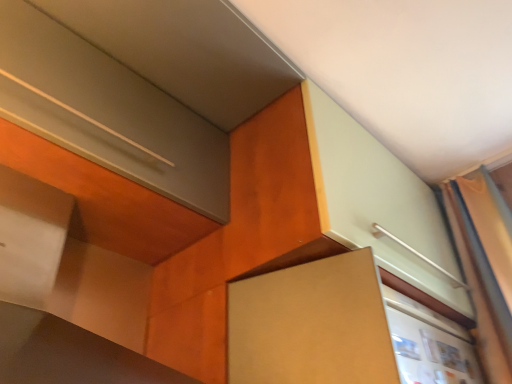
Question: Is silky orange curtain at right positioned beyond the bounds of brown matte cabinet at center?

Choices:
 (A) no
 (B) yes

Answer: (B)

Question: Is silky orange curtain at right smaller than brown matte cabinet at center?

Choices:
 (A) yes
 (B) no

Answer: (B)

Question: Considering the relative sizes of silky orange curtain at right and brown matte cabinet at center in the image provided, is silky orange curtain at right wider than brown matte cabinet at center?

Choices:
 (A) no
 (B) yes

Answer: (A)

Question: Is silky orange curtain at right shorter than brown matte cabinet at center?

Choices:
 (A) no
 (B) yes

Answer: (A)

Question: Can you confirm if silky orange curtain at right is bigger than brown matte cabinet at center?

Choices:
 (A) yes
 (B) no

Answer: (A)

Question: Is silky orange curtain at right thinner than brown matte cabinet at center?

Choices:
 (A) no
 (B) yes

Answer: (B)

Question: Is brown matte cabinet at center at the right side of silky orange curtain at right?

Choices:
 (A) yes
 (B) no

Answer: (B)

Question: Is brown matte cabinet at center turned away from silky orange curtain at right?

Choices:
 (A) yes
 (B) no

Answer: (B)

Question: Does brown matte cabinet at center come behind silky orange curtain at right?

Choices:
 (A) no
 (B) yes

Answer: (A)

Question: Is silky orange curtain at right inside brown matte cabinet at center?

Choices:
 (A) no
 (B) yes

Answer: (A)

Question: Is brown matte cabinet at center located outside silky orange curtain at right?

Choices:
 (A) yes
 (B) no

Answer: (A)

Question: Considering the relative sizes of brown matte cabinet at center and silky orange curtain at right in the image provided, is brown matte cabinet at center taller than silky orange curtain at right?

Choices:
 (A) yes
 (B) no

Answer: (B)

Question: Visually, is brown matte cabinet at center positioned to the left or to the right of silky orange curtain at right?

Choices:
 (A) left
 (B) right

Answer: (A)